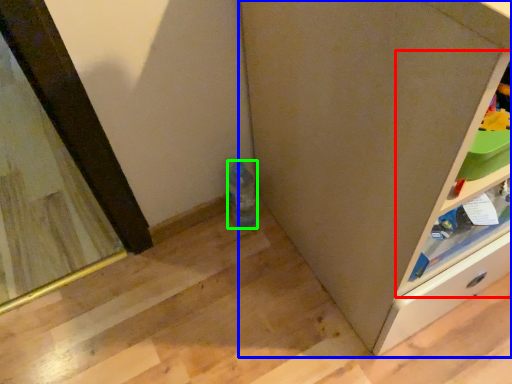
Question: Which object is positioned closest to shelf (highlighted by a red box)? Select from cabinetry (highlighted by a blue box) and bottle (highlighted by a green box).

Choices:
 (A) cabinetry
 (B) bottle

Answer: (A)